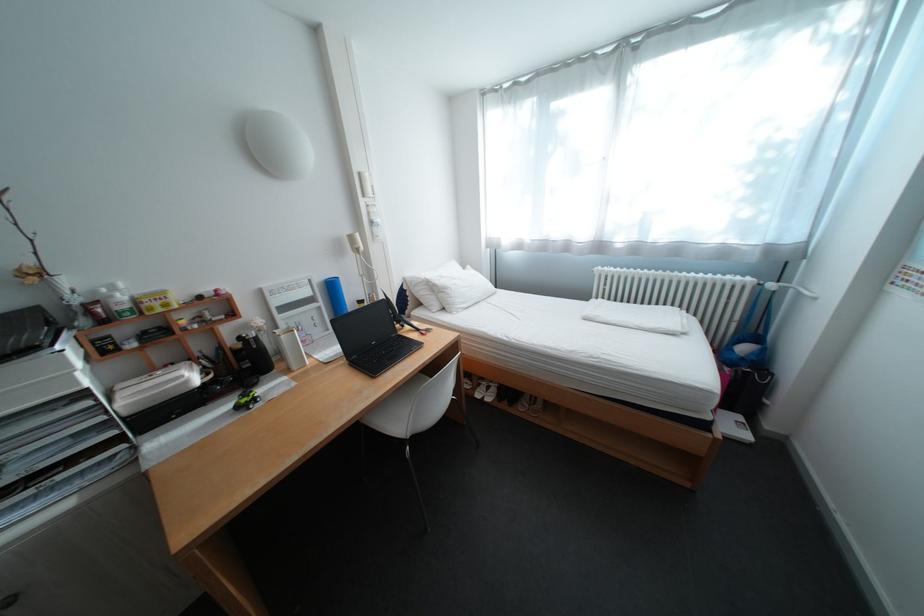
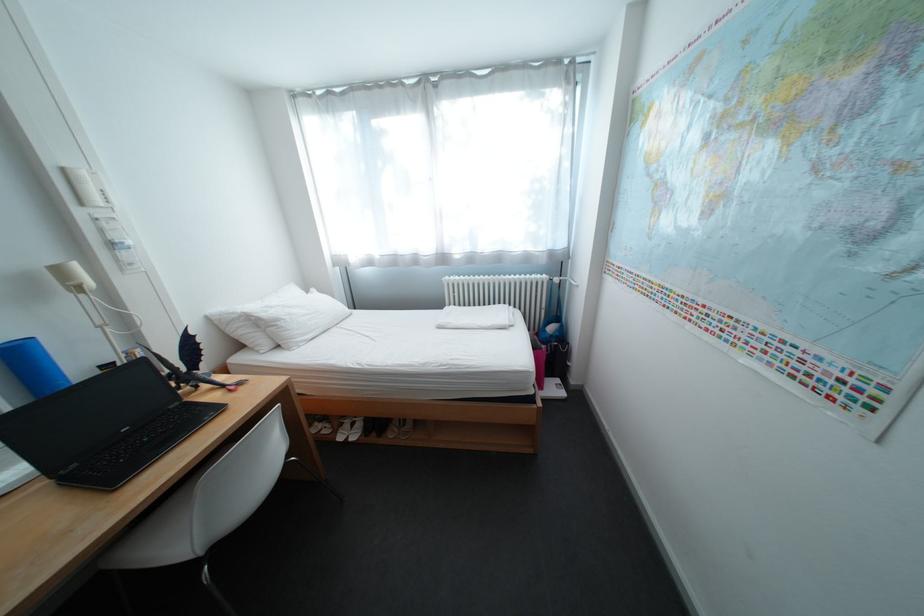
The point at (459, 290) is marked in the first image. Where is the corresponding point in the second image?

(292, 322)